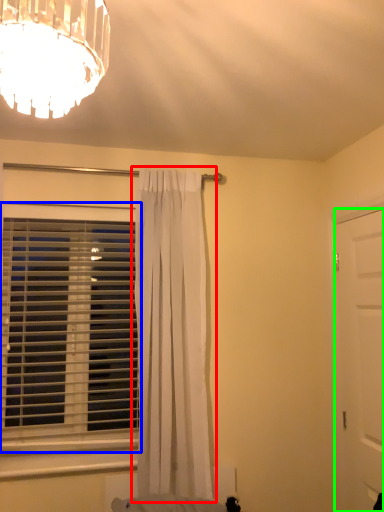
Question: Which object is positioned closest to curtain (highlighted by a red box)? Select from window blind (highlighted by a blue box) and door (highlighted by a green box).

Choices:
 (A) window blind
 (B) door

Answer: (A)